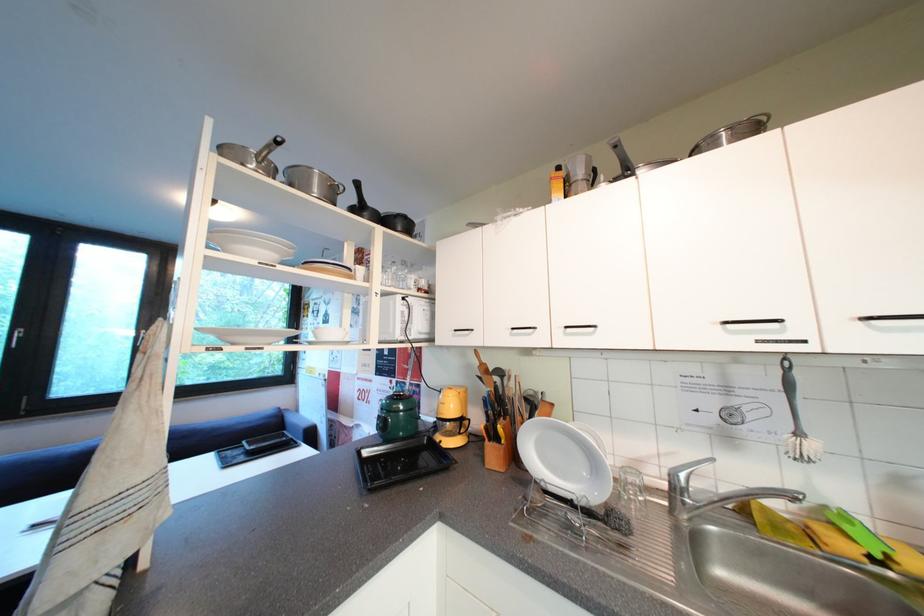
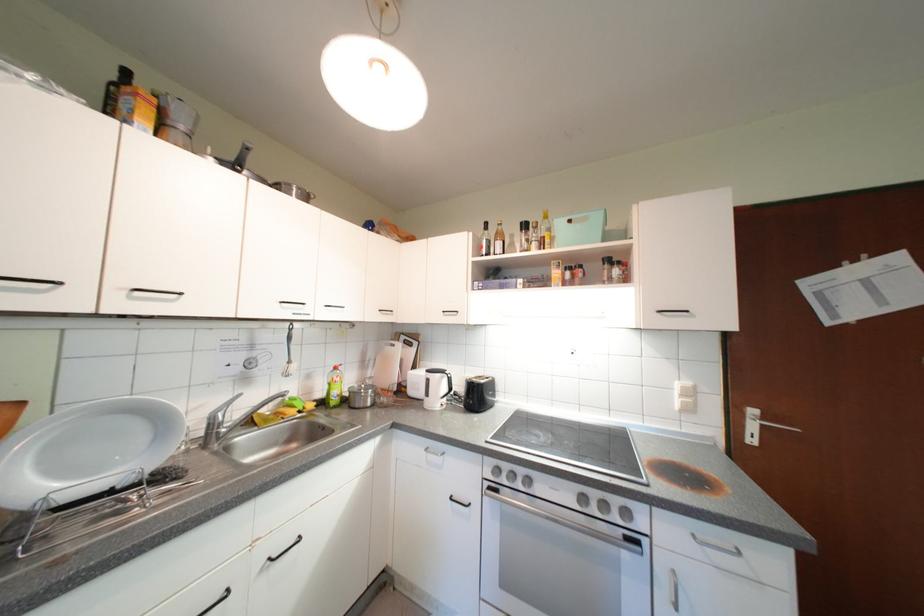
Where in the second image is the point corresponding to (x=574, y=336) from the first image?

(139, 300)